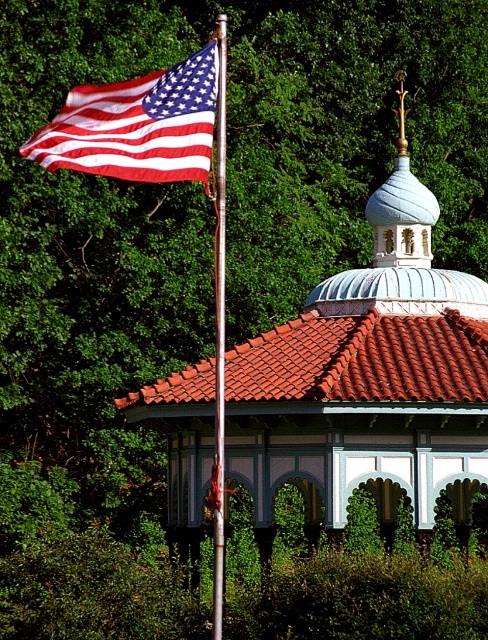
Is matte fabric flag at upper left wider than white textured dome at upper center?

No.

Who is positioned more to the left, matte fabric flag at upper left or white textured dome at upper center?

From the viewer's perspective, matte fabric flag at upper left appears more on the left side.

In order to click on matte fabric flag at upper left in this screenshot , I will do `click(137, 125)`.

This screenshot has width=488, height=640. What are the coordinates of `matte fabric flag at upper left` in the screenshot? It's located at (137, 125).

Which is behind, point (313, 362) or point (90, 134)?

The point (313, 362) is behind.

Consider the image. Can you confirm if red clay tiles at center is positioned to the left of matte fabric flag at upper left?

Incorrect, red clay tiles at center is not on the left side of matte fabric flag at upper left.

Is point (284, 339) less distant than point (217, 70)?

No, it is behind (217, 70).

Locate an element on the screen. red clay tiles at center is located at coordinates (363, 358).

Is white painted wood gazebo at center shorter than white textured dome at upper center?

No.

Does white painted wood gazebo at center appear over white textured dome at upper center?

No.

Between point (482, 368) and point (395, 161), which one is positioned in front?

Point (482, 368)

The image size is (488, 640). I want to click on white painted wood gazebo at center, so click(x=367, y=376).